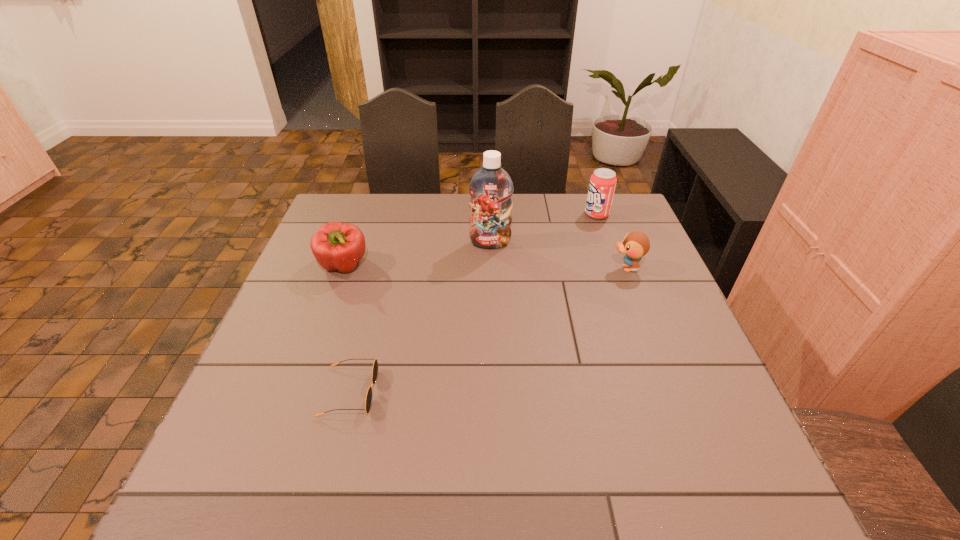
The width and height of the screenshot is (960, 540). I want to click on empty space between the duck and the sunglasses, so click(x=488, y=330).

You are a GUI agent. You are given a task and a screenshot of the screen. Output one action in this format:
    pyautogui.click(x=<x>, y=<y>)
    Task: Click on the vacant region between the tallest object and the soda can
    The height and width of the screenshot is (540, 960).
    Given the screenshot: What is the action you would take?
    pyautogui.click(x=543, y=228)

In order to click on vacant region between the shampoo and the sunglasses in this screenshot , I will do `click(420, 318)`.

You are a GUI agent. You are given a task and a screenshot of the screen. Output one action in this format:
    pyautogui.click(x=<x>, y=<y>)
    Task: Click on the vacant space that is in between the bell pepper and the duck
    The height and width of the screenshot is (540, 960).
    Given the screenshot: What is the action you would take?
    pyautogui.click(x=485, y=267)

Locate which object is the third closest to the shortest object. Please provide its 2D coordinates. Your answer should be formatted as a tuple, i.e. [(x, y)], where the tuple contains the x and y coordinates of a point satisfying the conditions above.

[(636, 244)]

Choose which object is the second nearest neighbor to the bell pepper. Please provide its 2D coordinates. Your answer should be formatted as a tuple, i.e. [(x, y)], where the tuple contains the x and y coordinates of a point satisfying the conditions above.

[(375, 366)]

Locate an element on the screen. Image resolution: width=960 pixels, height=540 pixels. vacant space that satisfies the following two spatial constraints: 1. on the surface of the farthest object; 2. on the front label of the third object from right to left is located at coordinates (607, 243).